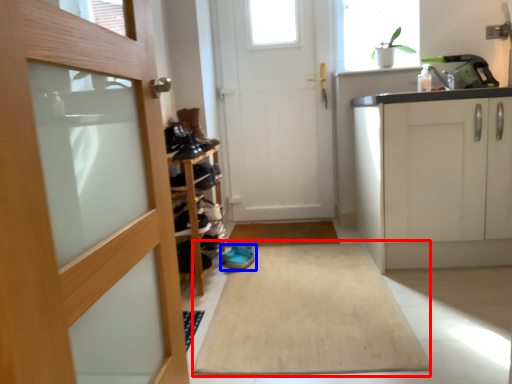
Question: Which of the following is the closest to the observer, bath mat (highlighted by a red box) or footwear (highlighted by a blue box)?

Choices:
 (A) bath mat
 (B) footwear

Answer: (A)